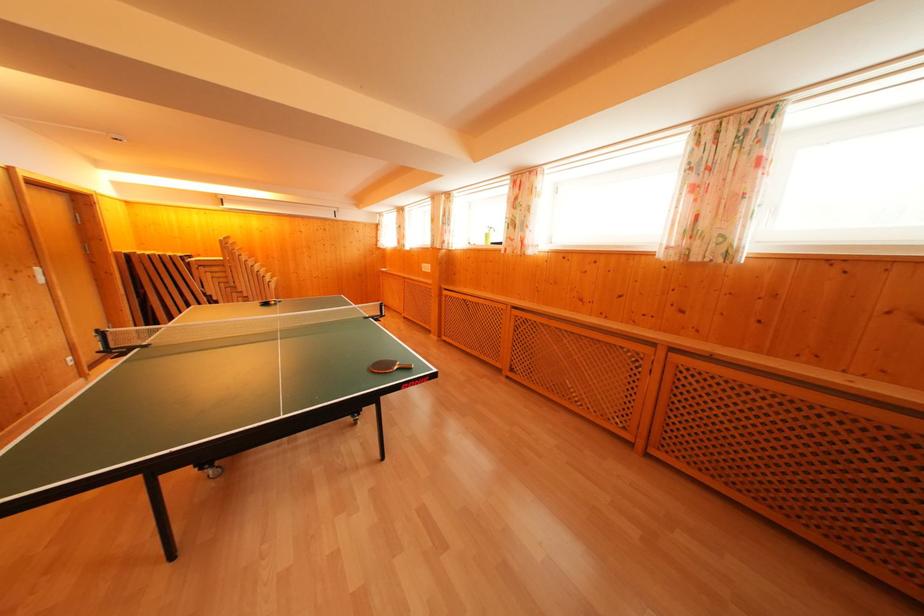
Locate an element on the screen. This screenshot has height=616, width=924. chair sitting surface is located at coordinates point(157,286).